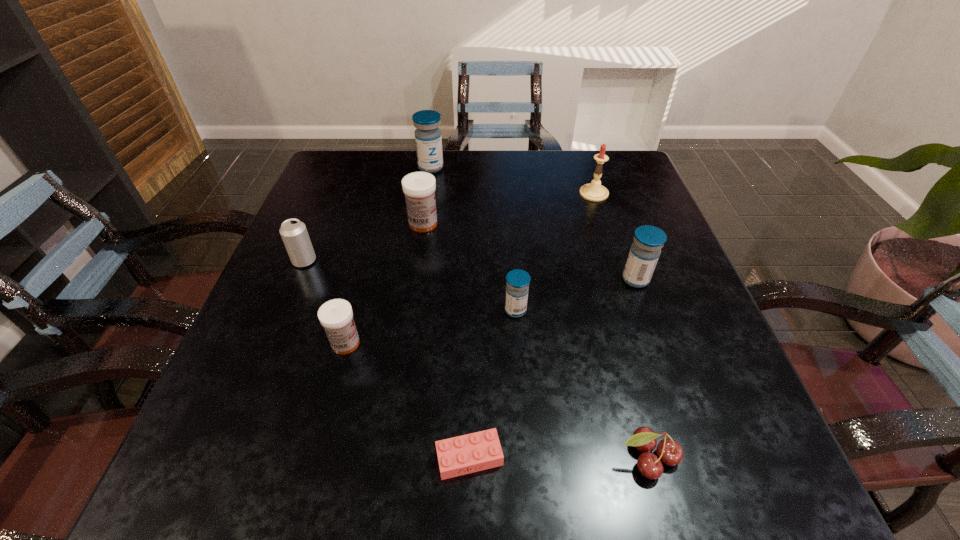
Image resolution: width=960 pixels, height=540 pixels. Identify the location of free space between the leftmost blue medicine and the fifth object from left to right. (450, 313).

Locate which object is the fourth closest to the fourth farthest medicine. Please provide its 2D coordinates. Your answer should be formatted as a tuple, i.e. [(x, y)], where the tuple contains the x and y coordinates of a point satisfying the conditions above.

[(419, 188)]

The width and height of the screenshot is (960, 540). I want to click on the fourth closest object to the biggest blue medicine, so click(517, 288).

The height and width of the screenshot is (540, 960). In order to click on medicine that is the fourth closest to the fourth medicine from left to right in this screenshot , I will do `click(428, 139)`.

I want to click on medicine that stands as the closest to the fifth object from right to left, so click(336, 316).

Where is `blue medicine that stands as the third closest to the red candle`? The height and width of the screenshot is (540, 960). blue medicine that stands as the third closest to the red candle is located at coordinates (517, 288).

Where is `blue medicine that is the second nearest to the red cherry`? This screenshot has width=960, height=540. blue medicine that is the second nearest to the red cherry is located at coordinates (644, 253).

The height and width of the screenshot is (540, 960). What are the coordinates of `free space in the image that satisfies the following two spatial constraints: 1. on the front side of the tallest medicine; 2. on the left side of the fifth object from left to right` in the screenshot? It's located at (388, 457).

Find the location of a particular element. This screenshot has width=960, height=540. vacant position in the image that satisfies the following two spatial constraints: 1. on the front side of the beer can; 2. on the left side of the second medicine from right to left is located at coordinates (284, 310).

You are a GUI agent. You are given a task and a screenshot of the screen. Output one action in this format:
    pyautogui.click(x=<x>, y=<y>)
    Task: Click on the free location that satisfies the following two spatial constraints: 1. on the front side of the fourth medicine from left to right; 2. on the right side of the farthest blue medicine
    
    Given the screenshot: What is the action you would take?
    pyautogui.click(x=410, y=310)